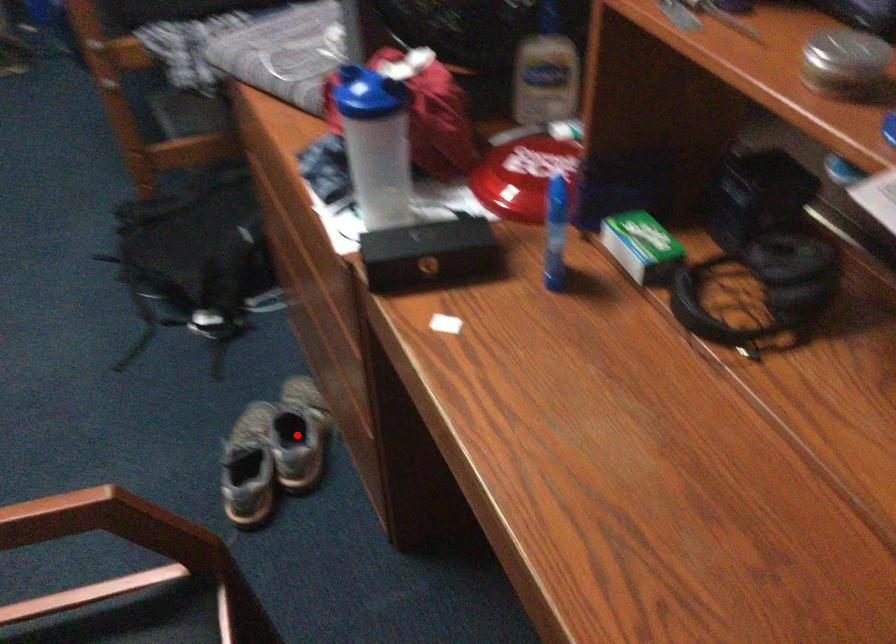
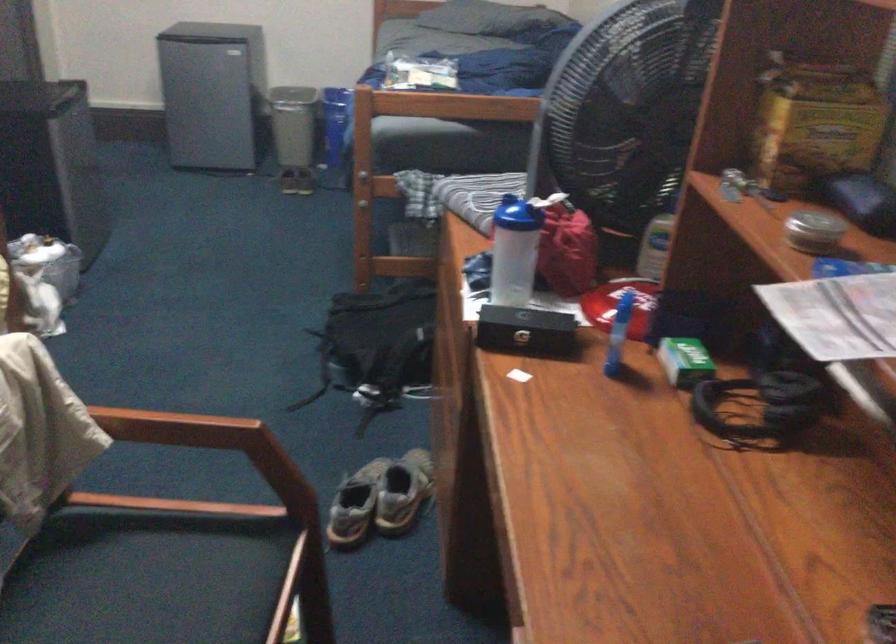
Where in the second image is the point corresponding to the highlighted location from the first image?

(402, 491)